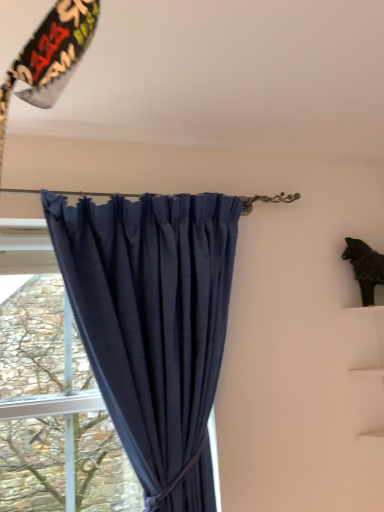
Identify the location of navy blue fabric curtain at center. This screenshot has width=384, height=512. (153, 325).

Where is `navy blue fabric curtain at center`? The image size is (384, 512). navy blue fabric curtain at center is located at coordinates (153, 325).

From a real-world perspective, who is located higher, green leafy tree at left or black matte cat at upper right?

black matte cat at upper right.

From the image's perspective, is green leafy tree at left positioned above or below black matte cat at upper right?

green leafy tree at left is situated lower than black matte cat at upper right in the image.

What's the angular difference between green leafy tree at left and black matte cat at upper right's facing directions?

There is a 30.9-degree angle between the facing directions of green leafy tree at left and black matte cat at upper right.

Does green leafy tree at left have a smaller size compared to black matte cat at upper right?

Incorrect, green leafy tree at left is not smaller in size than black matte cat at upper right.

Considering the relative positions of black matte cat at upper right and navy blue fabric curtain at center in the image provided, is black matte cat at upper right to the left of navy blue fabric curtain at center from the viewer's perspective?

No.

Is black matte cat at upper right positioned with its back to navy blue fabric curtain at center?

No, navy blue fabric curtain at center is not at the back of black matte cat at upper right.

In terms of size, does black matte cat at upper right appear bigger or smaller than navy blue fabric curtain at center?

Clearly, black matte cat at upper right is smaller in size than navy blue fabric curtain at center.

From a real-world perspective, between black matte cat at upper right and navy blue fabric curtain at center, who is vertically higher?

From a 3D spatial view, black matte cat at upper right is above.

Between navy blue fabric curtain at center and black matte cat at upper right, which one has more height?

navy blue fabric curtain at center.

Can you confirm if navy blue fabric curtain at center is wider than black matte cat at upper right?

Correct, the width of navy blue fabric curtain at center exceeds that of black matte cat at upper right.

Is point (148, 500) positioned after point (360, 290)?

No, it is in front of (360, 290).

Is navy blue fabric curtain at center looking in the opposite direction of green leafy tree at left?

Yes, navy blue fabric curtain at center's orientation is away from green leafy tree at left.

Can you tell me how much navy blue fabric curtain at center and green leafy tree at left differ in facing direction?

The angle between the facing direction of navy blue fabric curtain at center and the facing direction of green leafy tree at left is 1.7 degrees.

Between navy blue fabric curtain at center and green leafy tree at left, which one is positioned in front?

navy blue fabric curtain at center is closer to the camera.

Can you tell me how much green leafy tree at left and navy blue fabric curtain at center differ in facing direction?

They differ by 1.7 degrees in their facing directions.

Based on their sizes in the image, would you say green leafy tree at left is bigger or smaller than navy blue fabric curtain at center?

green leafy tree at left is smaller than navy blue fabric curtain at center.

Considering the sizes of objects green leafy tree at left and navy blue fabric curtain at center in the image provided, who is thinner, green leafy tree at left or navy blue fabric curtain at center?

green leafy tree at left.

Consider the image. How many degrees apart are the facing directions of black matte cat at upper right and green leafy tree at left?

There is a 30.9-degree angle between the facing directions of black matte cat at upper right and green leafy tree at left.

Is black matte cat at upper right positioned behind green leafy tree at left?

Yes, black matte cat at upper right is behind green leafy tree at left.

Is black matte cat at upper right taller than green leafy tree at left?

No, black matte cat at upper right is not taller than green leafy tree at left.

Locate an element on the screen. animal behind the green leafy tree at left is located at coordinates (365, 267).

You are a GUI agent. You are given a task and a screenshot of the screen. Output one action in this format:
    pyautogui.click(x=<x>, y=<y>)
    Task: Click on the animal on the right of green leafy tree at left
    This screenshot has height=512, width=384.
    Given the screenshot: What is the action you would take?
    pyautogui.click(x=365, y=267)

The height and width of the screenshot is (512, 384). In order to click on curtain that appears in front of the black matte cat at upper right in this screenshot , I will do `click(153, 325)`.

Looking at this image, considering their positions, is green leafy tree at left positioned further to navy blue fabric curtain at center than black matte cat at upper right?

Based on the image, black matte cat at upper right appears to be further to navy blue fabric curtain at center.

From the image, which object appears to be farther from black matte cat at upper right, navy blue fabric curtain at center or green leafy tree at left?

Based on the image, green leafy tree at left appears to be further to black matte cat at upper right.

Estimate the real-world distances between objects in this image. Which object is further from black matte cat at upper right, green leafy tree at left or navy blue fabric curtain at center?

Based on the image, green leafy tree at left appears to be further to black matte cat at upper right.

Consider the image. Looking at the image, which one is located further to green leafy tree at left, navy blue fabric curtain at center or black matte cat at upper right?

Among the two, black matte cat at upper right is located further to green leafy tree at left.

Looking at the image, which one is located further to navy blue fabric curtain at center, black matte cat at upper right or green leafy tree at left?

Among the two, black matte cat at upper right is located further to navy blue fabric curtain at center.

Consider the image. Based on their spatial positions, is black matte cat at upper right or navy blue fabric curtain at center further from green leafy tree at left?

black matte cat at upper right.

At what (x,y) coordinates should I click in order to perform the action: click on curtain situated between green leafy tree at left and black matte cat at upper right from left to right. Please return your answer as a coordinate pair (x, y). This screenshot has width=384, height=512. Looking at the image, I should click on (153, 325).